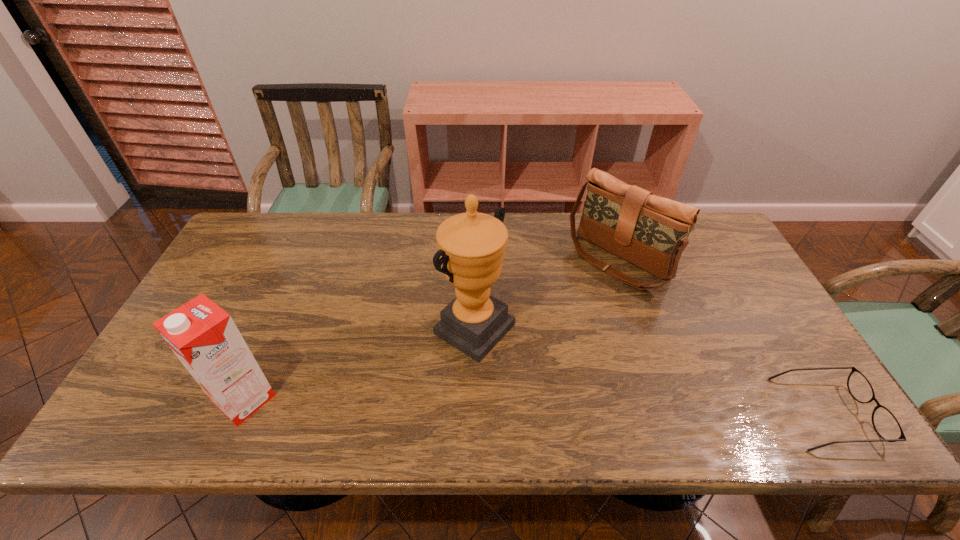
The height and width of the screenshot is (540, 960). Find the location of `vacant area between the third nearest object and the shortest object`. vacant area between the third nearest object and the shortest object is located at coordinates (x=650, y=371).

Locate an element on the screen. free point between the tallest object and the third shortest object is located at coordinates (360, 364).

Where is `blank region between the shortest object and the third object from left to right`? Image resolution: width=960 pixels, height=540 pixels. blank region between the shortest object and the third object from left to right is located at coordinates (722, 337).

The width and height of the screenshot is (960, 540). In order to click on empty space between the award and the leftmost object in this screenshot , I will do `click(360, 364)`.

Locate an element on the screen. The height and width of the screenshot is (540, 960). object that is the closest to the award is located at coordinates (651, 232).

Image resolution: width=960 pixels, height=540 pixels. In order to click on the second closest object to the carton in this screenshot , I will do `click(651, 232)`.

Locate an element on the screen. free location that satisfies the following two spatial constraints: 1. on the front side of the third shortest object; 2. on the front-facing side of the spectacles is located at coordinates (238, 413).

Locate an element on the screen. The image size is (960, 540). vacant region that satisfies the following two spatial constraints: 1. on the front side of the second shortest object; 2. on the front-facing side of the rightmost object is located at coordinates (670, 413).

Find the location of a particular element. The image size is (960, 540). free point that satisfies the following two spatial constraints: 1. on the front side of the second shortest object; 2. on the front-facing side of the shortest object is located at coordinates (670, 413).

You are a GUI agent. You are given a task and a screenshot of the screen. Output one action in this format:
    pyautogui.click(x=<x>, y=<y>)
    Task: Click on the vacant space that satisfies the following two spatial constraints: 1. on the front side of the third nearest object; 2. on the front-facing side of the shortest object
    The height and width of the screenshot is (540, 960).
    Given the screenshot: What is the action you would take?
    pyautogui.click(x=473, y=413)